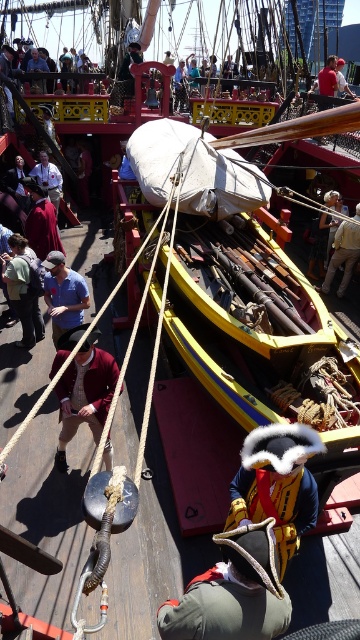
Consider the image. You are a costume designer observing the ship scene. You need to determine the spatial relationship between the green felt hat at center and the maroon wool coat at lower left. Which object is positioned to the right of the other?

The green felt hat at center is to the right of the maroon wool coat at lower left.

You are standing on the deck of the historic ship and need to pass a message from the green felt hat at center to the matte blue shirt at center. Given that you can only move in a straight line, will you have to navigate around any obstacles between them?

The green felt hat at center is 4.74 meters away from the matte blue shirt at center. Since there are no obstacles mentioned in the scene description between them, you can move in a straight line without needing to navigate around any obstacles.

You are a costume designer observing the ship scene. You notice two items at the center of the image. Which item is positioned lower down between the green felt hat at center and the matte blue shirt at center?

The green felt hat at center is below the matte blue shirt at center, so the green felt hat at center is positioned lower down.